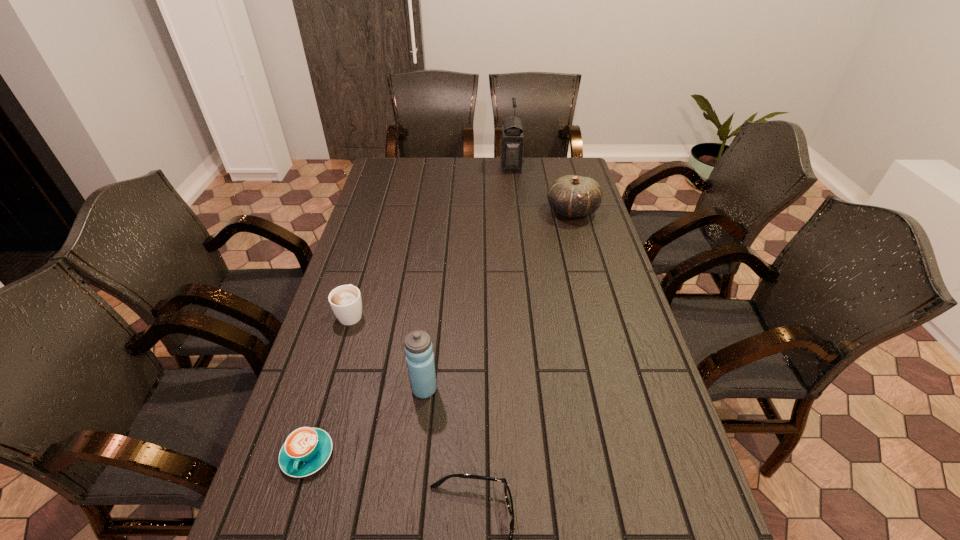
Locate an element on the screen. The image size is (960, 540). free space located 0.080m on the front-facing side of the tallest object is located at coordinates (482, 167).

The width and height of the screenshot is (960, 540). Identify the location of free space located 0.120m on the front-facing side of the tallest object. (472, 167).

This screenshot has width=960, height=540. Find the location of `vacant space situated on the front-facing side of the tallest object`. vacant space situated on the front-facing side of the tallest object is located at coordinates (410, 167).

The image size is (960, 540). I want to click on free space located 0.230m on the right of the second tallest object, so click(529, 389).

Locate an element on the screen. The width and height of the screenshot is (960, 540). vacant space located on the left of the third tallest object is located at coordinates (458, 211).

Find the location of a particular element. free space located with the handle on the side of the third farthest object is located at coordinates (365, 268).

Identify the location of free space located 0.210m with the handle on the side of the third farthest object. The width and height of the screenshot is (960, 540). (369, 256).

Image resolution: width=960 pixels, height=540 pixels. I want to click on vacant space situated 0.330m with the handle on the side of the third farthest object, so pyautogui.click(x=374, y=235).

Locate an element on the screen. The height and width of the screenshot is (540, 960). vacant point located 0.070m with the handle on the right side of the second nearest object is located at coordinates (289, 516).

Locate an element on the screen. The height and width of the screenshot is (540, 960). object at the far edge is located at coordinates (511, 140).